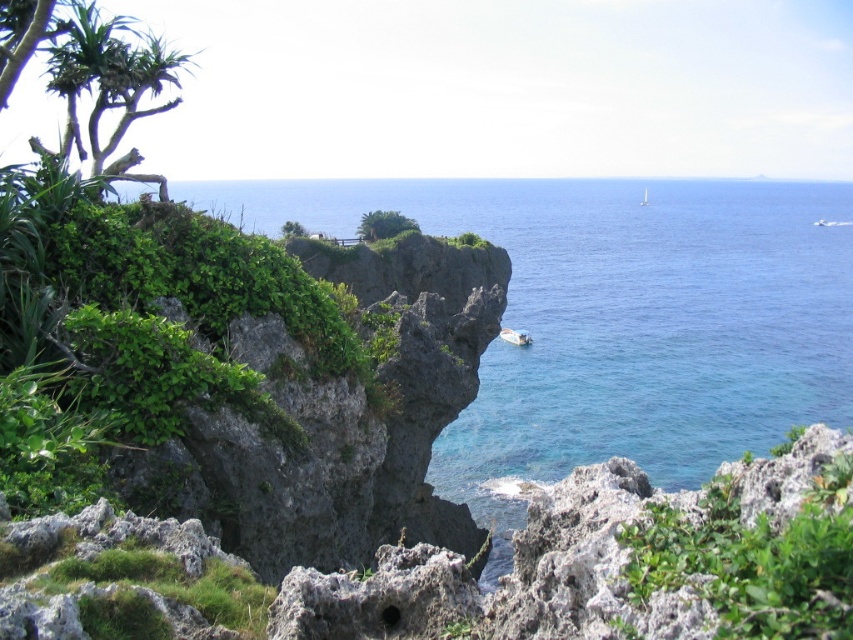
Question: Can you confirm if green leafy shrub at left is thinner than green leafy plant at center?

Choices:
 (A) yes
 (B) no

Answer: (A)

Question: Does green leafy shrub at left have a larger size compared to white glossy boat at center?

Choices:
 (A) no
 (B) yes

Answer: (B)

Question: Which of the following is the farthest from the observer?

Choices:
 (A) (364, 237)
 (B) (525, 333)

Answer: (B)

Question: Which of the following is the closest to the observer?

Choices:
 (A) green leafy plant at center
 (B) white glossy boat at center
 (C) green leafy shrub at left

Answer: (C)

Question: Where is green leafy shrub at left located in relation to white glossy boat at center in the image?

Choices:
 (A) right
 (B) left

Answer: (B)

Question: Which point is closer to the camera taking this photo?

Choices:
 (A) (360, 349)
 (B) (410, 228)
 (C) (525, 337)
 (D) (605, 289)

Answer: (A)